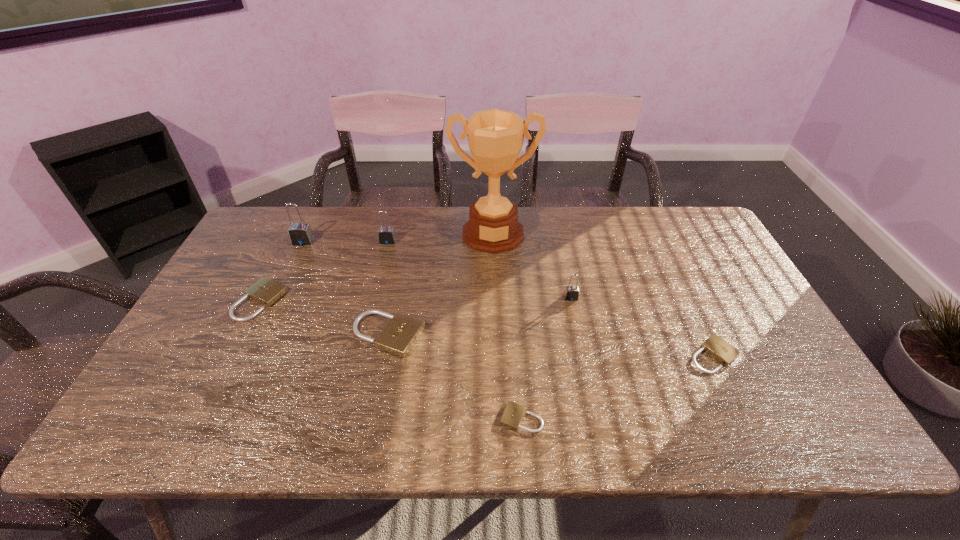
Locate an element on the screen. The image size is (960, 540). the third smallest beige padlock is located at coordinates (265, 291).

You are a GUI agent. You are given a task and a screenshot of the screen. Output one action in this format:
    pyautogui.click(x=<x>, y=<y>)
    Task: Click on the second shortest object
    
    Given the screenshot: What is the action you would take?
    pyautogui.click(x=715, y=346)

Where is `the second shortest padlock`? This screenshot has height=540, width=960. the second shortest padlock is located at coordinates (715, 346).

The height and width of the screenshot is (540, 960). I want to click on the shortest object, so click(x=513, y=414).

I want to click on the second beige padlock from right to left, so click(x=513, y=414).

Locate an element on the screen. blank space located on the front-facing side of the tallest object is located at coordinates (494, 273).

At what (x,y) coordinates should I click in order to perform the action: click on free point located on the shackle of the tallest padlock. Please return your answer as a coordinate pair (x, y). The image size is (960, 540). Looking at the image, I should click on (268, 318).

I want to click on vacant area situated 0.110m on the shackle of the second smallest gray padlock, so click(x=381, y=267).

The width and height of the screenshot is (960, 540). What are the coordinates of `free spot located 0.120m on the shackle of the rightmost gray padlock` in the screenshot? It's located at (579, 334).

Find the location of a particular element. This screenshot has height=540, width=960. free spot located 0.270m on the right of the fourth shortest padlock is located at coordinates (528, 335).